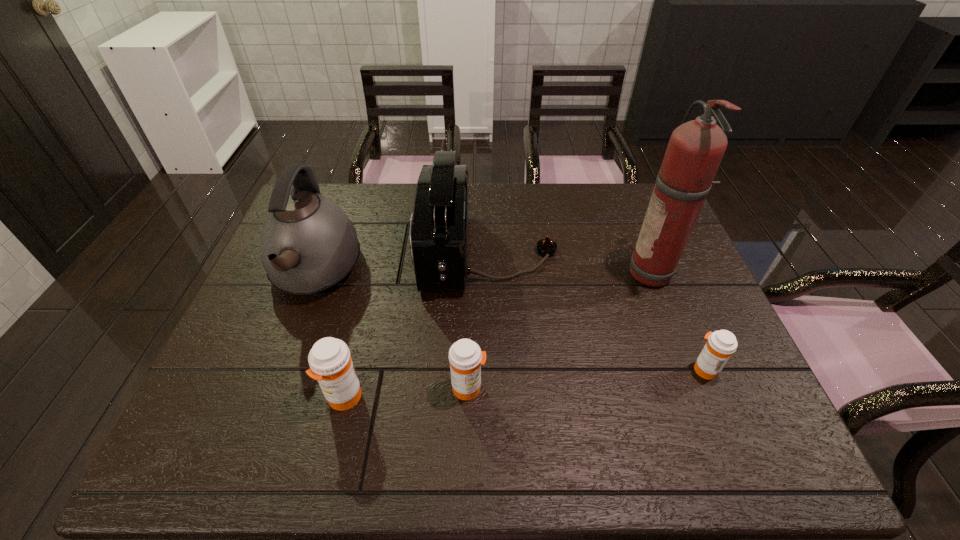
This screenshot has width=960, height=540. I want to click on the leftmost medicine, so click(330, 362).

This screenshot has width=960, height=540. Find the location of `the second medicine from right to left`. the second medicine from right to left is located at coordinates (465, 356).

You are a GUI agent. You are given a task and a screenshot of the screen. Output one action in this format:
    pyautogui.click(x=<x>, y=<y>)
    Task: Click on the second shortest object
    The width and height of the screenshot is (960, 540).
    Given the screenshot: What is the action you would take?
    pyautogui.click(x=465, y=356)

This screenshot has height=540, width=960. In order to click on the rightmost medicine in this screenshot , I will do `click(721, 344)`.

Identify the location of the shortest medicine. (721, 344).

Where is `radio receiver`? The image size is (960, 540). radio receiver is located at coordinates (439, 226).

Find the location of a particular element. kettle is located at coordinates (309, 245).

Locate an element on the screen. This screenshot has height=540, width=960. fire extinguisher is located at coordinates (695, 150).

Locate an element on the screen. The image size is (960, 540). free space located on the right of the leftmost medicine is located at coordinates (536, 397).

What are the coordinates of `vacant space located on the right of the second shortest medicine` in the screenshot? It's located at (625, 388).